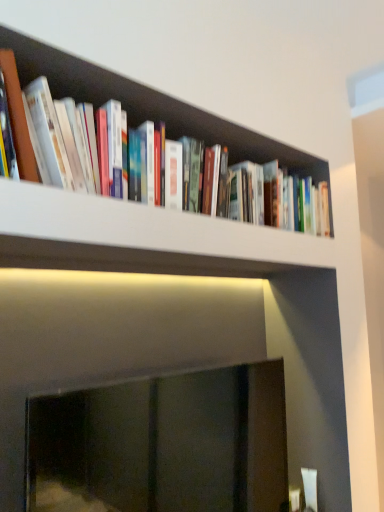
Question: Is black glass fireplace at center completely or partially inside hardcover books at upper center?

Choices:
 (A) no
 (B) yes

Answer: (A)

Question: Is hardcover books at upper center wider than black glass fireplace at center?

Choices:
 (A) no
 (B) yes

Answer: (B)

Question: From a real-world perspective, is hardcover books at upper center over black glass fireplace at center?

Choices:
 (A) no
 (B) yes

Answer: (B)

Question: Is hardcover books at upper center outside of black glass fireplace at center?

Choices:
 (A) yes
 (B) no

Answer: (A)

Question: Considering the relative positions of hardcover books at upper center and black glass fireplace at center in the image provided, is hardcover books at upper center to the right of black glass fireplace at center from the viewer's perspective?

Choices:
 (A) no
 (B) yes

Answer: (B)

Question: Is hardcover books at upper center positioned behind black glass fireplace at center?

Choices:
 (A) yes
 (B) no

Answer: (A)

Question: Is black glass fireplace at center placed right next to hardcover books at upper center?

Choices:
 (A) no
 (B) yes

Answer: (A)

Question: Can you confirm if black glass fireplace at center is positioned to the right of hardcover books at upper center?

Choices:
 (A) no
 (B) yes

Answer: (A)

Question: Is hardcover books at upper center completely or partially inside black glass fireplace at center?

Choices:
 (A) no
 (B) yes

Answer: (A)

Question: From a real-world perspective, is black glass fireplace at center physically below hardcover books at upper center?

Choices:
 (A) no
 (B) yes

Answer: (B)

Question: Is black glass fireplace at center shorter than hardcover books at upper center?

Choices:
 (A) yes
 (B) no

Answer: (B)

Question: Is the depth of black glass fireplace at center greater than that of hardcover books at upper center?

Choices:
 (A) no
 (B) yes

Answer: (A)

Question: Would you say hardcover books at upper center is to the left or to the right of black glass fireplace at center in the picture?

Choices:
 (A) right
 (B) left

Answer: (A)